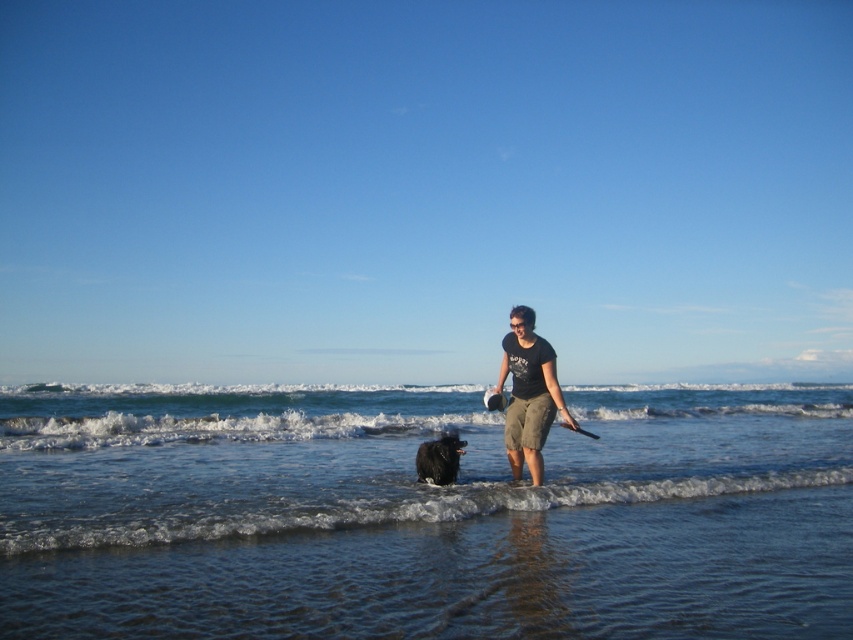
What do you see at coordinates (422, 515) in the screenshot? I see `clear water at lower center` at bounding box center [422, 515].

How much distance is there between clear water at lower center and black fluffy dog at center?

clear water at lower center and black fluffy dog at center are 19.11 meters apart.

The width and height of the screenshot is (853, 640). In order to click on clear water at lower center in this screenshot , I will do `click(422, 515)`.

At what (x,y) coordinates should I click in order to perform the action: click on clear water at lower center. Please return your answer as a coordinate pair (x, y). Looking at the image, I should click on (422, 515).

Is matte black t-shirt at center to the left of black fluffy dog at center from the viewer's perspective?

Incorrect, matte black t-shirt at center is not on the left side of black fluffy dog at center.

Where is `matte black t-shirt at center`? matte black t-shirt at center is located at coordinates (529, 394).

Find the location of a particular element. The width and height of the screenshot is (853, 640). matte black t-shirt at center is located at coordinates (529, 394).

Does clear water at lower center have a greater height compared to matte black t-shirt at center?

Correct, clear water at lower center is much taller as matte black t-shirt at center.

Is clear water at lower center in front of matte black t-shirt at center?

Yes.

Is point (3, 608) farther from viewer compared to point (544, 436)?

No, (3, 608) is in front of (544, 436).

Find the location of a particular element. This screenshot has height=640, width=853. clear water at lower center is located at coordinates (422, 515).